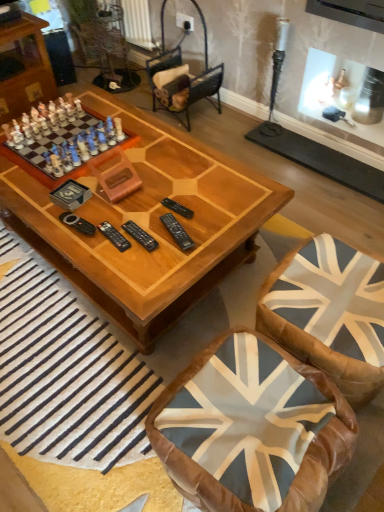
I want to click on free space on the front side of porcelain chess set at left, so click(63, 210).